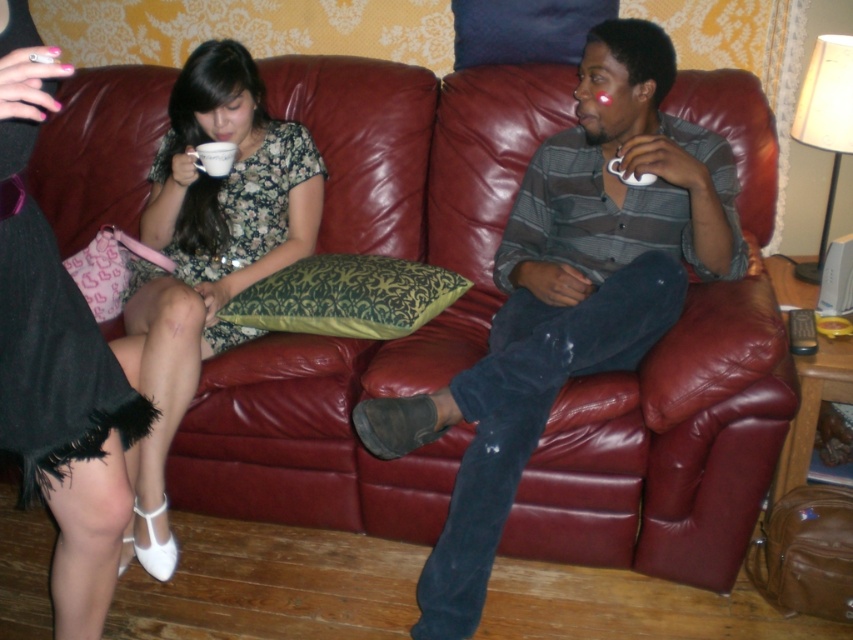
You are a photographer setting up a shoot in this living room. You need to position a light source so that it illuminates the floral dress at left and the matte floral dress at center without casting shadows on the couch. Given their heights, which dress should be closer to the light source?

The floral dress at left is taller than the matte floral dress at center, so positioning the light source closer to the floral dress at left would ensure both dresses are illuminated adequately while minimizing shadows on the couch.

You are a delivery robot that needs to place a small package between the floral dress at left and the matte floral dress at center. Can you fit the package if it measures 20 inches in length?

The distance between the floral dress at left and the matte floral dress at center is 22.54 inches. Since the package is 20 inches long, it can fit within the space as 20 inches is shorter than 22.54 inches.